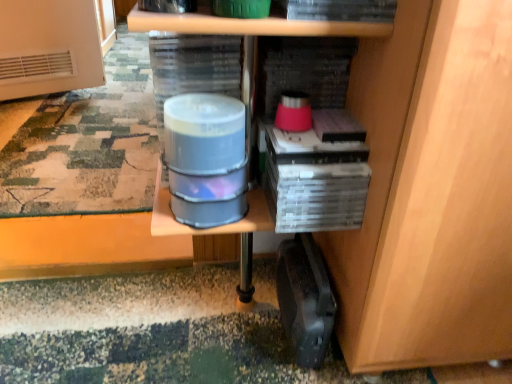
You are a GUI agent. You are given a task and a screenshot of the screen. Output one action in this format:
    pyautogui.click(x=<x>, y=<y>)
    Task: Click on the translucent plastic water at center
    
    Given the screenshot: What is the action you would take?
    pyautogui.click(x=205, y=158)

This screenshot has width=512, height=384. Describe the element at coordinates (305, 299) in the screenshot. I see `black plastic briefcase at lower right` at that location.

The height and width of the screenshot is (384, 512). What do you see at coordinates (88, 144) in the screenshot? I see `camouflage fabric mat at lower left` at bounding box center [88, 144].

You are a GUI agent. You are given a task and a screenshot of the screen. Output one action in this format:
    pyautogui.click(x=<x>, y=<y>)
    Task: Click on the camouflage fabric mat at lower left
    The height and width of the screenshot is (384, 512).
    Given the screenshot: What is the action you would take?
    pyautogui.click(x=88, y=144)

At what (x,y) coordinates should I click in order to perform the action: click on translucent plastic water at center. Please return your answer as a coordinate pair (x, y). Image resolution: width=512 pixels, height=384 pixels. Looking at the image, I should click on (205, 158).

Where is `mat on the left of the black plastic briefcase at lower right`? mat on the left of the black plastic briefcase at lower right is located at coordinates (88, 144).

How many degrees apart are the facing directions of black plastic briefcase at lower right and camouflage fabric mat at lower left?

They differ by 98.3 degrees in their facing directions.

Looking at this image, is black plastic briefcase at lower right wider or thinner than camouflage fabric mat at lower left?

In the image, black plastic briefcase at lower right appears to be more narrow than camouflage fabric mat at lower left.

Is black plastic briefcase at lower right situated inside translucent plastic water at center or outside?

black plastic briefcase at lower right cannot be found inside translucent plastic water at center.

Is black plastic briefcase at lower right oriented towards translucent plastic water at center?

No, black plastic briefcase at lower right is not aimed at translucent plastic water at center.

You are a GUI agent. You are given a task and a screenshot of the screen. Output one action in this format:
    pyautogui.click(x=<x>, y=<y>)
    Task: Click on the wide that appears below the translucent plastic water at center (from the image's perspective)
    
    Given the screenshot: What is the action you would take?
    pyautogui.click(x=305, y=299)

Looking at this image, between black plastic briefcase at lower right and translucent plastic water at center, which one has less height?

translucent plastic water at center.

Identify the location of wide above the camouflage fabric mat at lower left (from a real-world perspective). This screenshot has height=384, width=512. (305, 299).

From the image's perspective, which is below, camouflage fabric mat at lower left or black plastic briefcase at lower right?

black plastic briefcase at lower right appears lower in the image.

Is camouflage fabric mat at lower left far away from black plastic briefcase at lower right?

No, camouflage fabric mat at lower left is in close proximity to black plastic briefcase at lower right.

Is camouflage fabric mat at lower left with translucent plastic water at center?

Answer: No, camouflage fabric mat at lower left is not next to translucent plastic water at center.

Looking at the image, does camouflage fabric mat at lower left seem bigger or smaller compared to translucent plastic water at center?

In the image, camouflage fabric mat at lower left appears to be larger than translucent plastic water at center.

The image size is (512, 384). I want to click on mat below the translucent plastic water at center (from a real-world perspective), so point(88,144).

From the image's perspective, which is above, camouflage fabric mat at lower left or translucent plastic water at center?

camouflage fabric mat at lower left is shown above in the image.

Between translucent plastic water at center and camouflage fabric mat at lower left, which one has smaller size?

Smaller between the two is translucent plastic water at center.

Consider the image. Between translucent plastic water at center and camouflage fabric mat at lower left, which one has less height?

camouflage fabric mat at lower left.

Is there a large distance between translucent plastic water at center and camouflage fabric mat at lower left?

translucent plastic water at center is near camouflage fabric mat at lower left, not far away.

At what (x,y) coordinates should I click in order to perform the action: click on wide below the translucent plastic water at center (from the image's perspective). Please return your answer as a coordinate pair (x, y). Image resolution: width=512 pixels, height=384 pixels. Looking at the image, I should click on (305, 299).

How much distance is there between translucent plastic water at center and black plastic briefcase at lower right?

translucent plastic water at center is 11.58 inches away from black plastic briefcase at lower right.

Is translucent plastic water at center far away from black plastic briefcase at lower right?

translucent plastic water at center is actually quite close to black plastic briefcase at lower right.

Considering the relative positions of translucent plastic water at center and black plastic briefcase at lower right in the image provided, is translucent plastic water at center to the left or to the right of black plastic briefcase at lower right?

Clearly, translucent plastic water at center is on the left of black plastic briefcase at lower right in the image.

I want to click on wide above the camouflage fabric mat at lower left (from a real-world perspective), so click(x=305, y=299).

Identify the location of wide directly beneath the translucent plastic water at center (from a real-world perspective). The image size is (512, 384). (305, 299).

From the image, which object appears to be nearer to black plastic briefcase at lower right, translucent plastic water at center or camouflage fabric mat at lower left?

Among the two, translucent plastic water at center is located nearer to black plastic briefcase at lower right.

From the image, which object appears to be nearer to black plastic briefcase at lower right, camouflage fabric mat at lower left or translucent plastic water at center?

translucent plastic water at center is positioned closer to the anchor black plastic briefcase at lower right.

Based on their spatial positions, is camouflage fabric mat at lower left or black plastic briefcase at lower right closer to translucent plastic water at center?

Based on the image, black plastic briefcase at lower right appears to be nearer to translucent plastic water at center.

Which object lies further to the anchor point camouflage fabric mat at lower left, translucent plastic water at center or black plastic briefcase at lower right?

translucent plastic water at center is further to camouflage fabric mat at lower left.

When comparing their distances from translucent plastic water at center, does black plastic briefcase at lower right or camouflage fabric mat at lower left seem further?

Based on the image, camouflage fabric mat at lower left appears to be further to translucent plastic water at center.

Estimate the real-world distances between objects in this image. Which object is closer to camouflage fabric mat at lower left, black plastic briefcase at lower right or translucent plastic water at center?

The object closer to camouflage fabric mat at lower left is black plastic briefcase at lower right.

Locate an element on the screen. water located between camouflage fabric mat at lower left and black plastic briefcase at lower right in the left-right direction is located at coordinates click(205, 158).